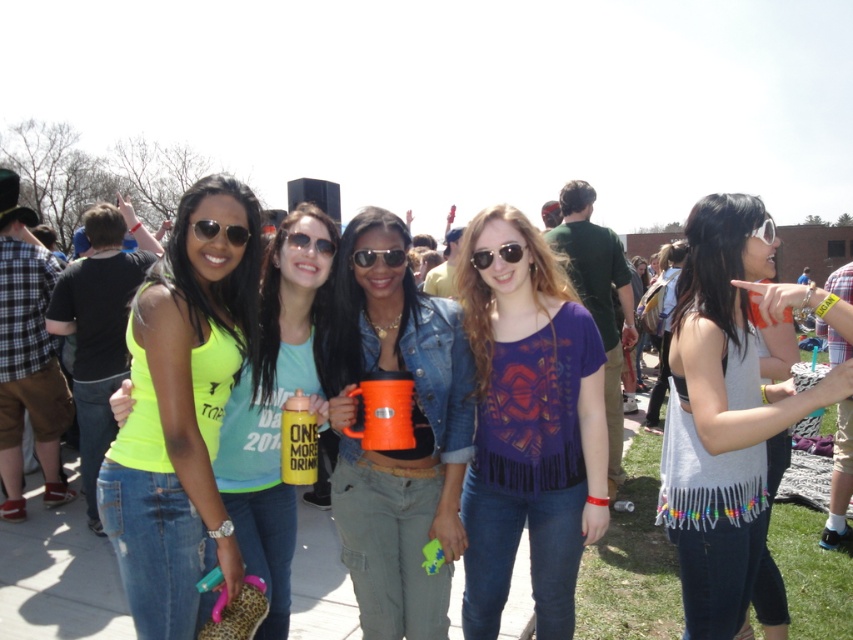
You are a photographer trying to capture the orange matte mug at center and the matte black sunglasses at upper center in a single shot. Which object should you focus on first to ensure both are in sharp focus?

You should focus on the orange matte mug at center first because it is closer to the viewer than the matte black sunglasses at upper center. By focusing on the closer object, the depth of field may also keep the sunglasses in focus.